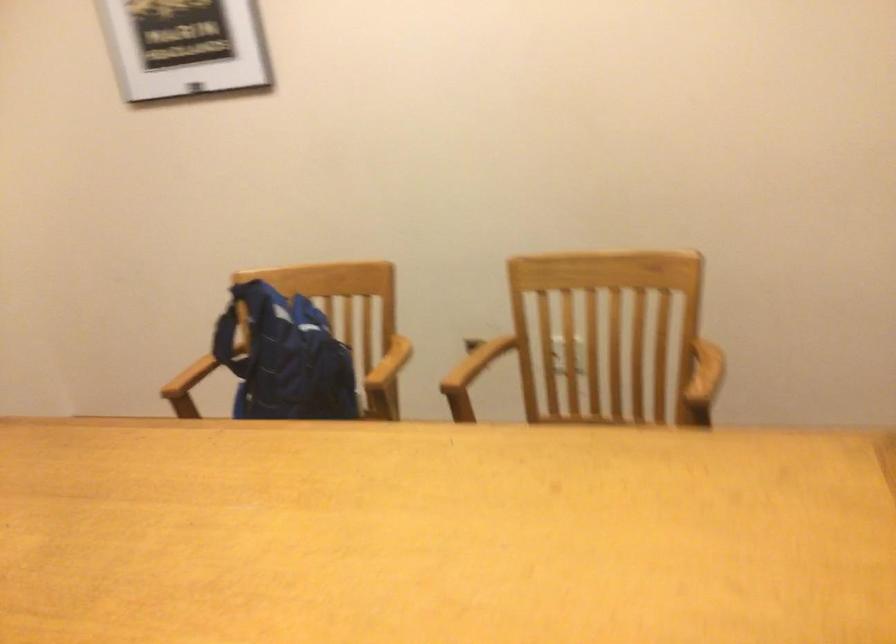
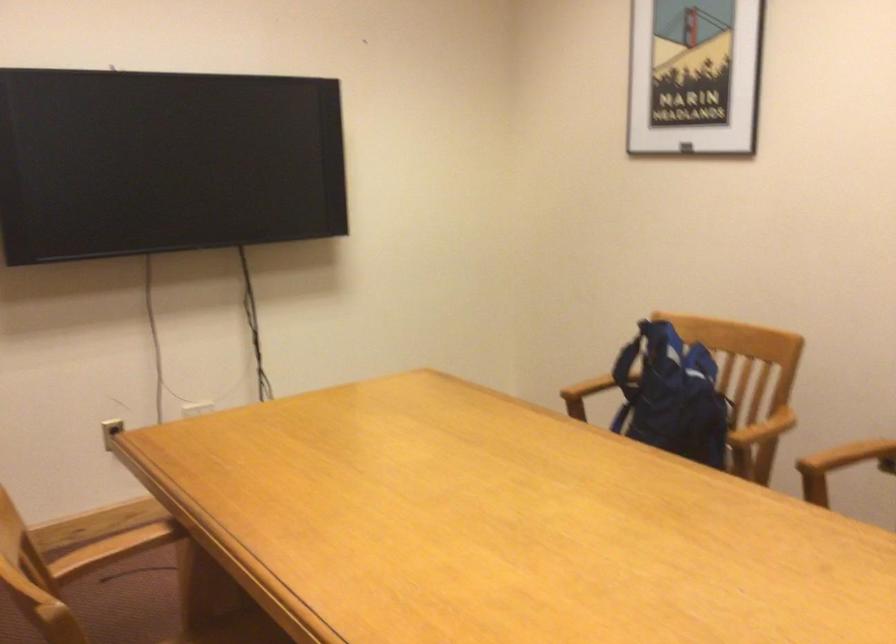
In the second image, find the point that corresponds to (x=302, y=348) in the first image.

(672, 395)